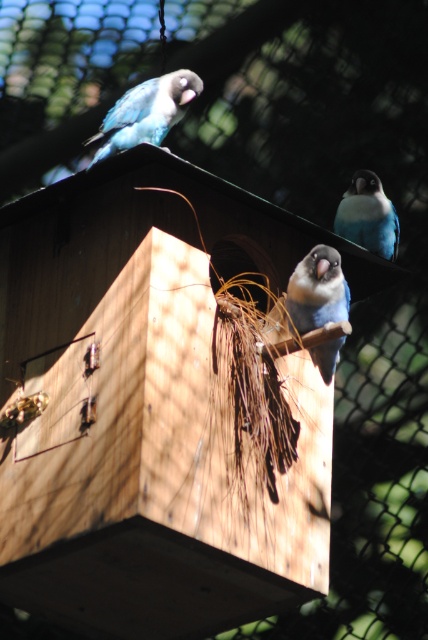
You are standing in a garden and see a blue matte parrot at center perched on a wooden birdhouse. If you want to place a small feeder 5 feet away from the parrot, will it be within your reach?

The blue matte parrot at center is 8.75 feet away from you. Placing a feeder 5 feet away from the parrot would place it 3.75 feet away from you, so yes, it would be within your reach.

You are a birdwatcher observing the birdhouse and notice two birds, the matte blue parrot at upper left and the blue matte parrot at center. Which bird is sitting higher on the birdhouse?

The matte blue parrot at upper left is positioned over the blue matte parrot at center, so it is sitting higher on the birdhouse.